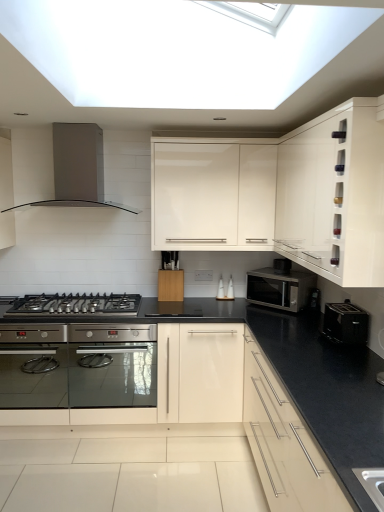
This screenshot has width=384, height=512. What do you see at coordinates (283, 444) in the screenshot? I see `matte white cabinet at lower right, placed as the first cabinetry when sorted from bottom to top` at bounding box center [283, 444].

This screenshot has width=384, height=512. Find the location of `black plastic toaster at right, the 1th appliance from the top`. black plastic toaster at right, the 1th appliance from the top is located at coordinates (282, 265).

Image resolution: width=384 pixels, height=512 pixels. I want to click on white glossy cabinet at upper center, arranged as the 3th cabinetry when ordered from the bottom, so click(x=212, y=195).

At what (x,y) coordinates should I click in order to perform the action: click on black stainless steel gas stove at lower left. Please return your answer as a coordinate pair (x, y). Looking at the image, I should click on 75,305.

Find the location of a particular element. matte white cabinet at lower right, placed as the first cabinetry when sorted from bottom to top is located at coordinates click(x=283, y=444).

Is the depth of black stainless steel gas stove at lower left greater than that of white glossy cabinet at upper right, which is the 2th cabinetry from top to bottom?

Yes.

Between black stainless steel gas stove at lower left and white glossy cabinet at upper right, which is the 2th cabinetry from top to bottom, which one has smaller width?

With smaller width is white glossy cabinet at upper right, which is the 2th cabinetry from top to bottom.

At what (x,y) coordinates should I click in order to perform the action: click on gas stove below the white glossy cabinet at upper right, which is the 2th cabinetry from top to bottom (from the image's perspective). Please return your answer as a coordinate pair (x, y). Looking at the image, I should click on (75, 305).

Is black stainless steel gas stove at lower left to the right of white glossy cabinet at upper right, which is the 2th cabinetry from top to bottom, from the viewer's perspective?

In fact, black stainless steel gas stove at lower left is to the left of white glossy cabinet at upper right, which is the 2th cabinetry from top to bottom.

Can you confirm if satin silver microwave at center-right is bigger than white glossy cabinet at upper center, arranged as the 3th cabinetry when ordered from the bottom?

No.

Is satin silver microwave at center-right shorter than white glossy cabinet at upper center, arranged as the 3th cabinetry when ordered from the bottom?

Yes, satin silver microwave at center-right is shorter than white glossy cabinet at upper center, arranged as the 3th cabinetry when ordered from the bottom.

Measure the distance between satin silver microwave at center-right and white glossy cabinet at upper center, arranged as the 3th cabinetry when ordered from the bottom.

satin silver microwave at center-right is 23.93 inches away from white glossy cabinet at upper center, arranged as the 3th cabinetry when ordered from the bottom.

Between satin silver microwave at center-right and white glossy cabinet at upper center, positioned as the first cabinetry in top-to-bottom order, which one has larger width?

white glossy cabinet at upper center, positioned as the first cabinetry in top-to-bottom order, is wider.

Considering the sizes of objects matte white cabinet at lower right, the 3th cabinetry when ordered from top to bottom, and white glossy cabinet at upper center, arranged as the 3th cabinetry when ordered from the bottom, in the image provided, who is wider, matte white cabinet at lower right, the 3th cabinetry when ordered from top to bottom, or white glossy cabinet at upper center, arranged as the 3th cabinetry when ordered from the bottom,?

Wider between the two is matte white cabinet at lower right, the 3th cabinetry when ordered from top to bottom.

Does matte white cabinet at lower right, placed as the first cabinetry when sorted from bottom to top, turn towards white glossy cabinet at upper center, arranged as the 3th cabinetry when ordered from the bottom?

No, matte white cabinet at lower right, placed as the first cabinetry when sorted from bottom to top, is not turned towards white glossy cabinet at upper center, arranged as the 3th cabinetry when ordered from the bottom.

Is point (259, 453) positioned before point (269, 230)?

Yes.

Does point (59, 168) appear closer or farther from the camera than point (282, 462)?

Point (59, 168) appears to be farther away from the viewer than point (282, 462).

Where is `home appliance behind the matte white cabinet at lower right, placed as the first cabinetry when sorted from bottom to top`? The height and width of the screenshot is (512, 384). home appliance behind the matte white cabinet at lower right, placed as the first cabinetry when sorted from bottom to top is located at coordinates (77, 168).

From the image's perspective, who appears lower, satin silver range hood at upper left or matte white cabinet at lower right, placed as the first cabinetry when sorted from bottom to top?

matte white cabinet at lower right, placed as the first cabinetry when sorted from bottom to top, from the image's perspective.

Which is more to the right, satin silver range hood at upper left or matte white cabinet at lower right, placed as the first cabinetry when sorted from bottom to top?

matte white cabinet at lower right, placed as the first cabinetry when sorted from bottom to top.

Is white glossy cabinet at upper center, positioned as the first cabinetry in top-to-bottom order, placed right next to black stainless steel gas stove at lower left?

No, white glossy cabinet at upper center, positioned as the first cabinetry in top-to-bottom order, is not in contact with black stainless steel gas stove at lower left.

From a real-world perspective, is white glossy cabinet at upper center, positioned as the first cabinetry in top-to-bottom order, physically located above or below black stainless steel gas stove at lower left?

white glossy cabinet at upper center, positioned as the first cabinetry in top-to-bottom order, is above black stainless steel gas stove at lower left.

Is white glossy cabinet at upper center, positioned as the first cabinetry in top-to-bottom order, positioned behind black stainless steel gas stove at lower left?

Yes, it is behind black stainless steel gas stove at lower left.

Is white glossy cabinet at upper center, arranged as the 3th cabinetry when ordered from the bottom, oriented away from black stainless steel gas stove at lower left?

white glossy cabinet at upper center, arranged as the 3th cabinetry when ordered from the bottom, is not turned away from black stainless steel gas stove at lower left.

Can you confirm if black stainless steel gas stove at lower left is positioned to the right of white glossy cabinet at upper center, positioned as the first cabinetry in top-to-bottom order?

Incorrect, black stainless steel gas stove at lower left is not on the right side of white glossy cabinet at upper center, positioned as the first cabinetry in top-to-bottom order.

Does black stainless steel gas stove at lower left have a greater height compared to white glossy cabinet at upper center, arranged as the 3th cabinetry when ordered from the bottom?

No.

Looking at their sizes, would you say black stainless steel gas stove at lower left is wider or thinner than white glossy cabinet at upper center, positioned as the first cabinetry in top-to-bottom order?

black stainless steel gas stove at lower left is wider than white glossy cabinet at upper center, positioned as the first cabinetry in top-to-bottom order.

From a real-world perspective, is black stainless steel gas stove at lower left beneath white glossy cabinet at upper center, arranged as the 3th cabinetry when ordered from the bottom?

Correct, in the physical world, black stainless steel gas stove at lower left is lower than white glossy cabinet at upper center, arranged as the 3th cabinetry when ordered from the bottom.

Considering the relative sizes of white glossy cabinet at upper center, arranged as the 3th cabinetry when ordered from the bottom, and black plastic toaster at right, the 1th appliance from the top, in the image provided, is white glossy cabinet at upper center, arranged as the 3th cabinetry when ordered from the bottom, wider than black plastic toaster at right, the 1th appliance from the top,?

Yes.

From a real-world perspective, which is physically above, white glossy cabinet at upper center, arranged as the 3th cabinetry when ordered from the bottom, or black plastic toaster at right, the second appliance ordered from the bottom?

From a 3D spatial view, white glossy cabinet at upper center, arranged as the 3th cabinetry when ordered from the bottom, is above.

Is white glossy cabinet at upper center, positioned as the first cabinetry in top-to-bottom order, positioned behind black plastic toaster at right, the second appliance ordered from the bottom?

No, white glossy cabinet at upper center, positioned as the first cabinetry in top-to-bottom order, is closer to the camera.

Image resolution: width=384 pixels, height=512 pixels. I want to click on the 1st cabinetry in front of the black stainless steel gas stove at lower left, counting from the anchor's position, so click(x=334, y=194).

From a real-world perspective, which cabinetry is the 1st one above the satin silver microwave at center-right? Please provide its 2D coordinates.

[(212, 195)]

Which object lies further to the anchor point black plastic toaster at right, which ranks as the 2th appliance in back-to-front order, black plastic toaster at right, marked as the second appliance in a front-to-back arrangement, or satin silver microwave at center-right?

Based on the image, black plastic toaster at right, marked as the second appliance in a front-to-back arrangement, appears to be further to black plastic toaster at right, which ranks as the 2th appliance in back-to-front order.

In the scene shown: Based on their spatial positions, is satin silver microwave at center-right or black plastic toaster at right, which ranks as the 2th appliance in back-to-front order, closer to white glossy cabinet at upper center, positioned as the first cabinetry in top-to-bottom order?

satin silver microwave at center-right is closer to white glossy cabinet at upper center, positioned as the first cabinetry in top-to-bottom order.

Which object lies further to the anchor point white glossy cabinet at upper right, which is the 2th cabinetry from top to bottom, satin silver range hood at upper left or black stainless steel gas stove at lower left?

satin silver range hood at upper left is further to white glossy cabinet at upper right, which is the 2th cabinetry from top to bottom.

When comparing their distances from black plastic toaster at right, the second appliance ordered from the bottom, does black plastic toaster at right, the first appliance from the bottom, or black stainless steel gas stove at lower left seem further?

black stainless steel gas stove at lower left.

Considering their positions, is white glossy cabinet at upper right, positioned as the 2th cabinetry in bottom-to-top order, positioned further to white glossy cabinet at upper center, positioned as the first cabinetry in top-to-bottom order, than black plastic toaster at right, the first appliance from the bottom?

black plastic toaster at right, the first appliance from the bottom.

Considering their positions, is satin silver range hood at upper left positioned closer to white glossy cabinet at upper center, arranged as the 3th cabinetry when ordered from the bottom, than matte white cabinet at lower right, placed as the first cabinetry when sorted from bottom to top?

satin silver range hood at upper left is positioned closer to the anchor white glossy cabinet at upper center, arranged as the 3th cabinetry when ordered from the bottom.

Which object lies further to the anchor point white glossy cabinet at upper center, positioned as the first cabinetry in top-to-bottom order, black plastic toaster at right, the first appliance when ordered from back to front, or black stainless steel gas stove at lower left?

Among the two, black stainless steel gas stove at lower left is located further to white glossy cabinet at upper center, positioned as the first cabinetry in top-to-bottom order.

From the image, which object appears to be farther from black stainless steel gas stove at lower left, matte white cabinet at lower right, placed as the first cabinetry when sorted from bottom to top, or black plastic toaster at right, which ranks as the 2th appliance in back-to-front order?

black plastic toaster at right, which ranks as the 2th appliance in back-to-front order, is positioned further to the anchor black stainless steel gas stove at lower left.

In order to click on cabinetry between white glossy cabinet at upper right, which is the 2th cabinetry from top to bottom, and black plastic toaster at right, the second appliance ordered from the bottom, along the z-axis in this screenshot , I will do `click(212, 195)`.

Where is `microwave oven between black stainless steel gas stove at lower left and white glossy cabinet at upper right, positioned as the 2th cabinetry in bottom-to-top order, in the horizontal direction`? This screenshot has width=384, height=512. microwave oven between black stainless steel gas stove at lower left and white glossy cabinet at upper right, positioned as the 2th cabinetry in bottom-to-top order, in the horizontal direction is located at coordinates (280, 288).

This screenshot has width=384, height=512. I want to click on gas stove located between satin silver range hood at upper left and white glossy cabinet at upper right, which is the 2th cabinetry from top to bottom, in the left-right direction, so click(x=75, y=305).

Locate an element on the screen. cabinetry situated between black stainless steel gas stove at lower left and matte white cabinet at lower right, placed as the first cabinetry when sorted from bottom to top, from left to right is located at coordinates (212, 195).